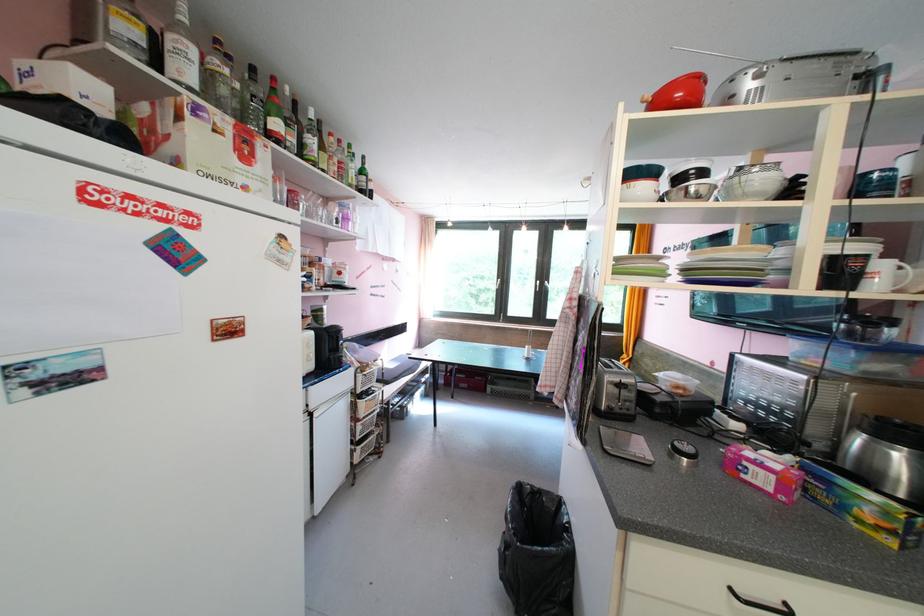
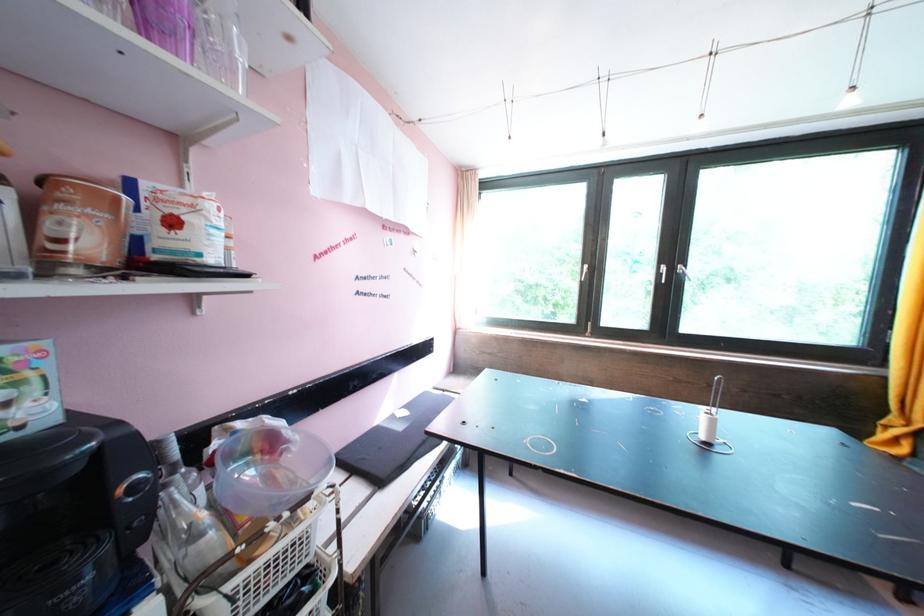
Locate, in the second image, the point that corresponds to (x=551, y=286) in the first image.

(679, 273)